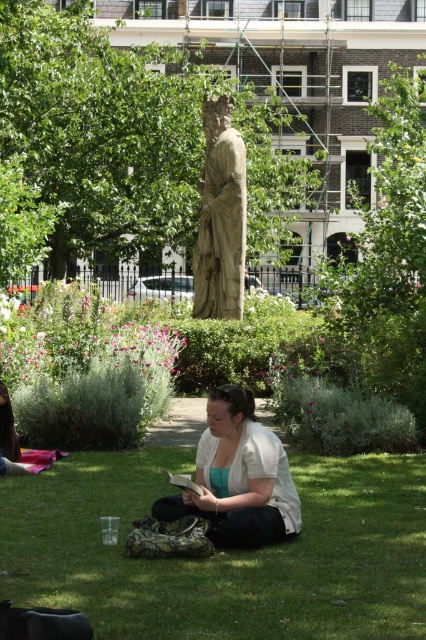
You are planning to set up a picnic blanket in the park scene. The blanket is 2 meters wide. Can the green grass at center accommodate the blanket without overlapping the stone statue at center?

The green grass at center has a larger width than the stone statue at center, but the exact dimensions aren answer the question. However, since the grass area is wider, it is likely that the 2m blanket can fit without overlapping the statue if positioned correctly.

You are planning to take a photo of the white cotton shirt at center and the stone statue at center. Which object should you focus on first if you want to capture both in a single frame without moving the camera? Explain your reasoning based on their sizes in the image.

The white cotton shirt at center is shorter than the stone statue at center. To capture both in a single frame without moving the camera, focus on the stone statue at center first since it is taller and will occupy more space in the frame, ensuring it fits properly before adjusting for the shorter white cotton shirt at center.